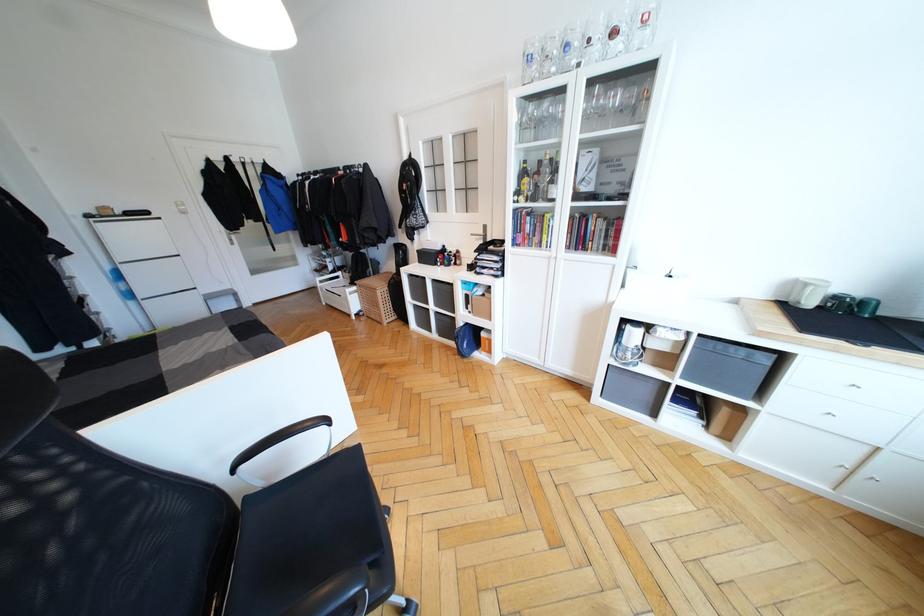
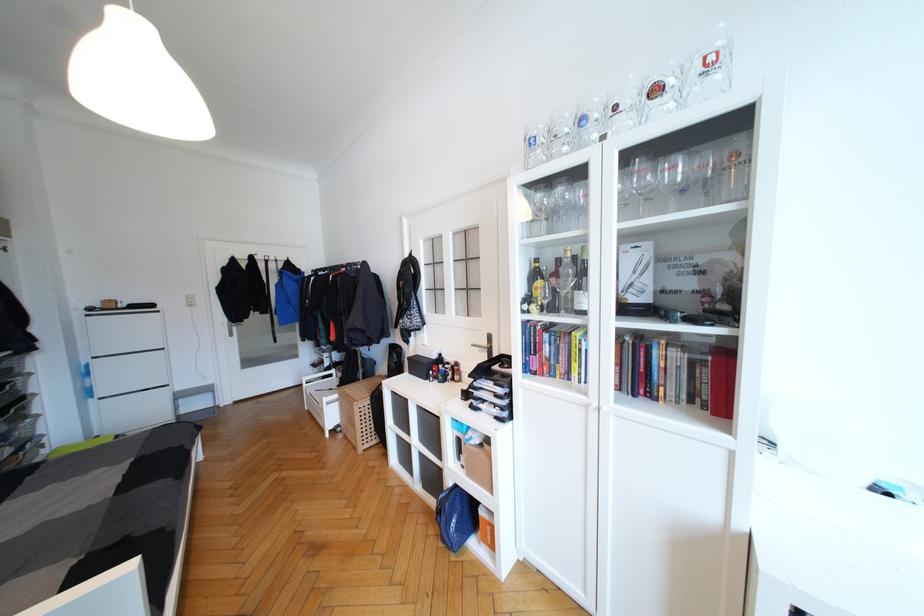
The point at (621, 99) is marked in the first image. Where is the corresponding point in the second image?

(679, 171)